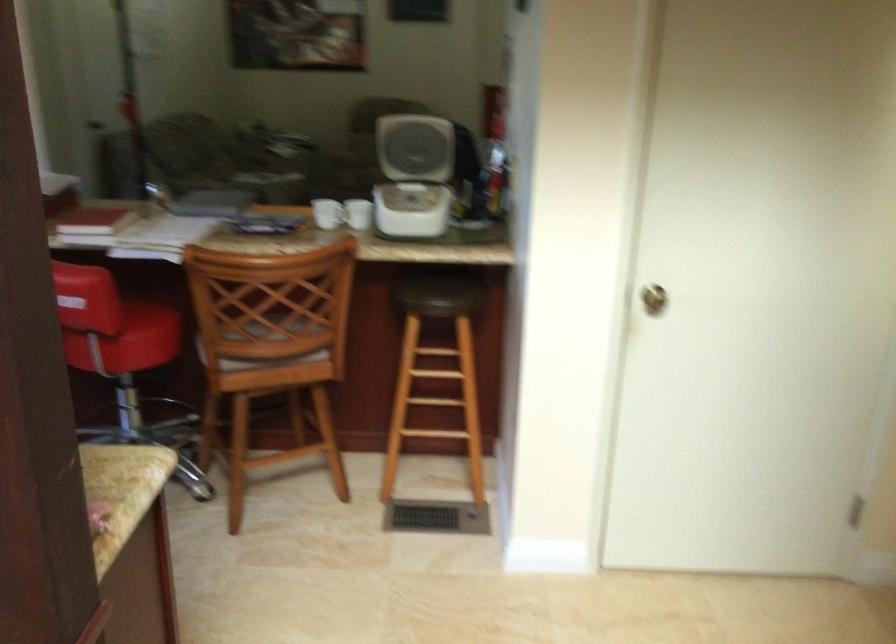
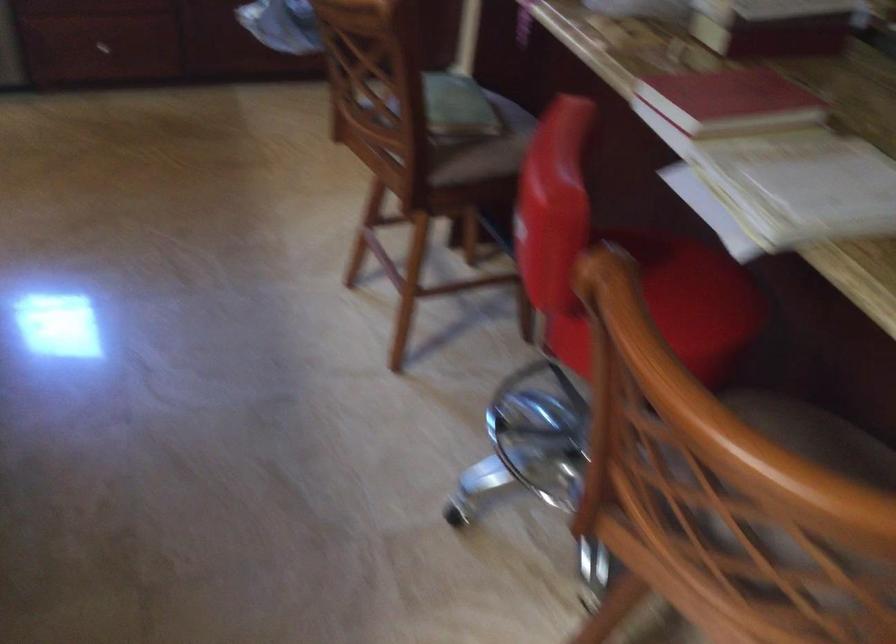
The point at (126, 307) is marked in the first image. Where is the corresponding point in the second image?

(669, 279)